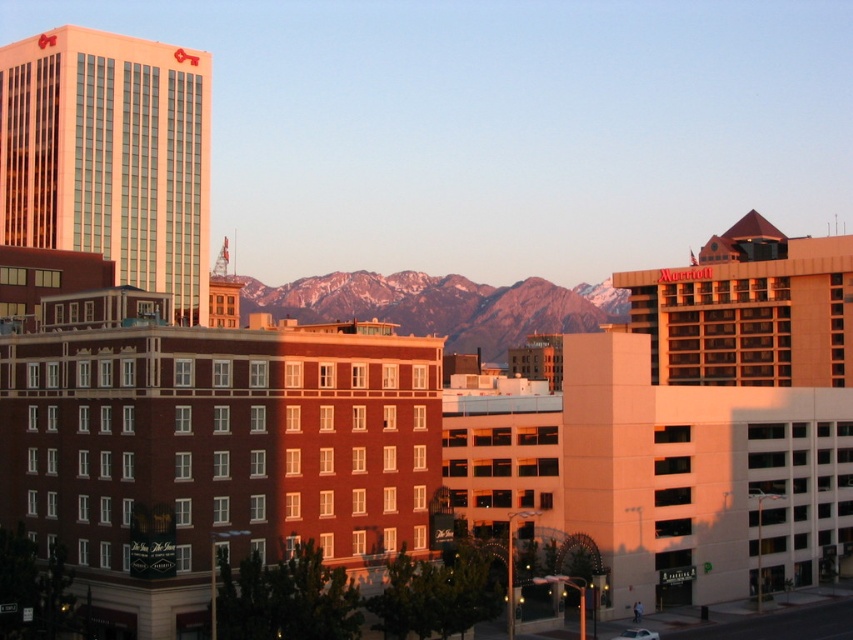
You are standing in the city and looking at the brick building at center and the snowy mountain range at center. Which one is closer to you?

The brick building at center is closer to you because it is positioned below the snowy mountain range at center, indicating it is in the foreground.

You are a drone operator who needs to capture a photo of the brown brick building at center. The drone has a maximum effective range of 60 meters. Can the drone safely take the photo without exceeding its range?

The distance of brown brick building at center from camera is 56.77 meters, which is within the drone operator maximum effective range of 60 meters. The drone can safely take the photo without exceeding its range.